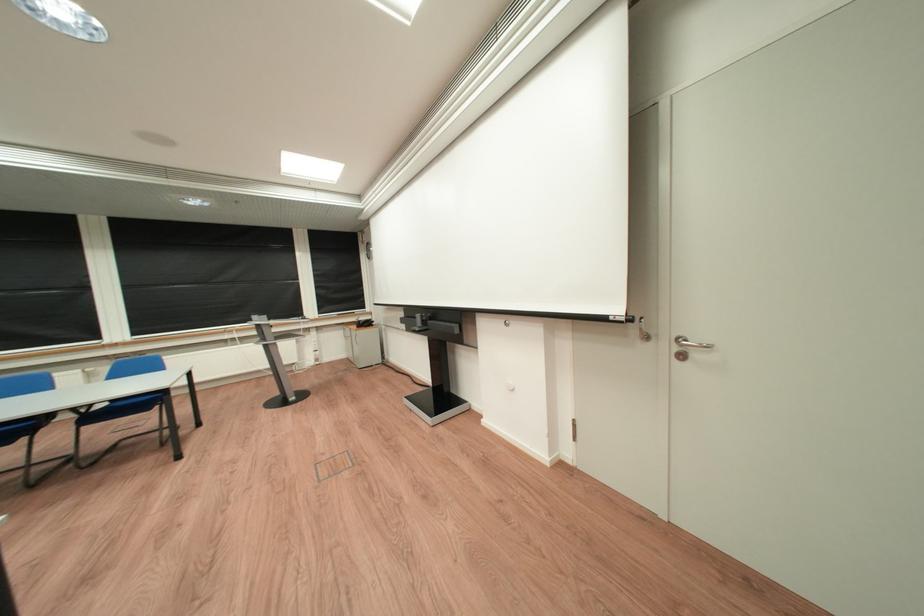
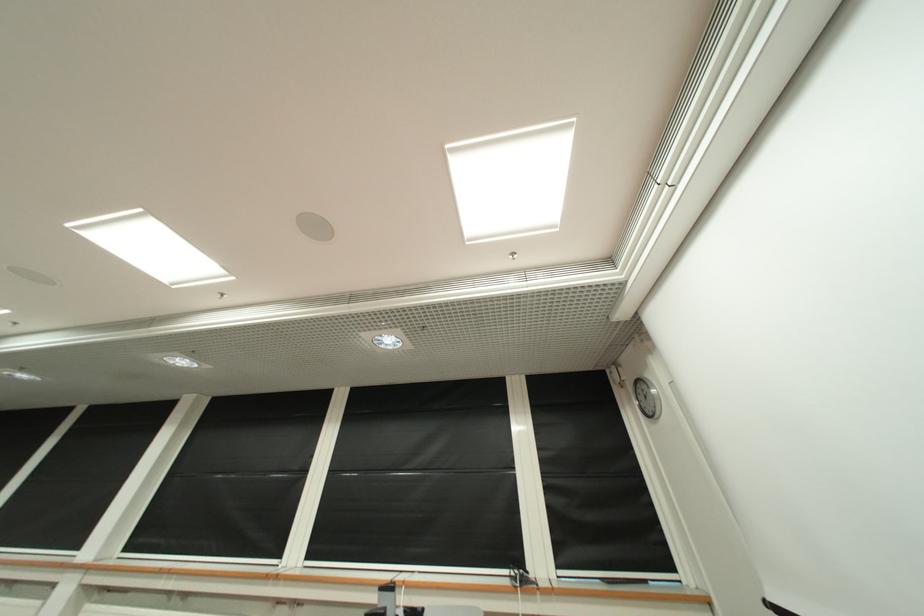
Locate, in the second image, the point that corresponds to pixel 147 336 in the first image.

(321, 560)